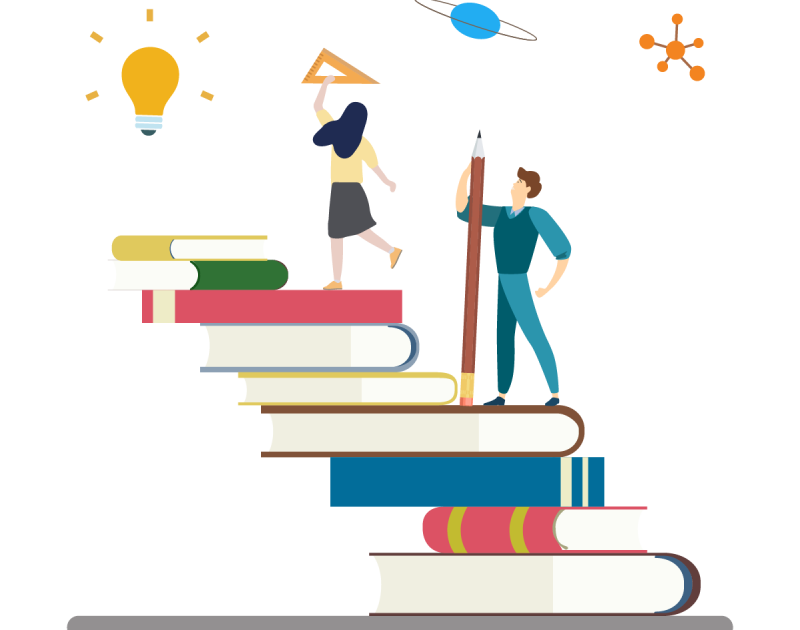
The image size is (800, 630). I want to click on books, so click(x=556, y=580), click(x=558, y=524), click(x=516, y=479), click(x=458, y=424), click(x=382, y=392), click(x=310, y=346), click(x=192, y=306), click(x=217, y=280), click(x=245, y=239).